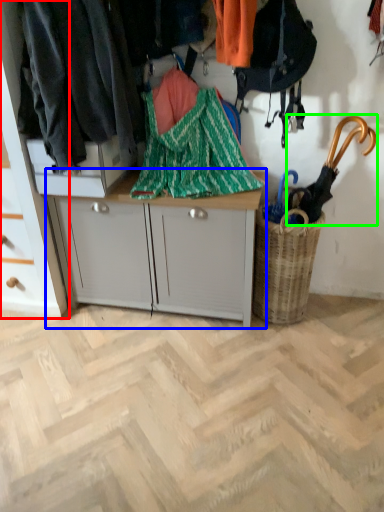
Question: Which object is the closest to the cabinetry (highlighted by a red box)? Choose among these: desk (highlighted by a blue box) or umbrella (highlighted by a green box).

Choices:
 (A) desk
 (B) umbrella

Answer: (A)